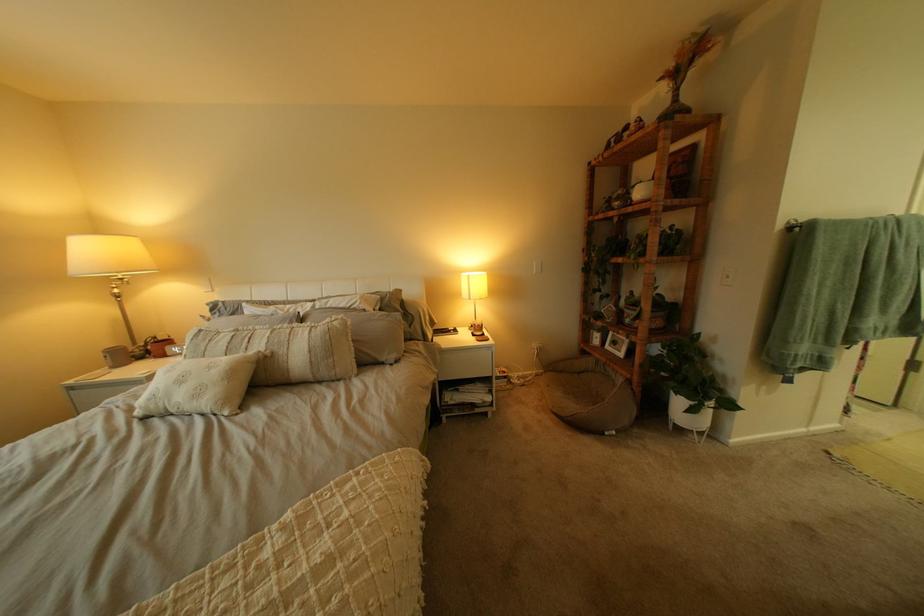
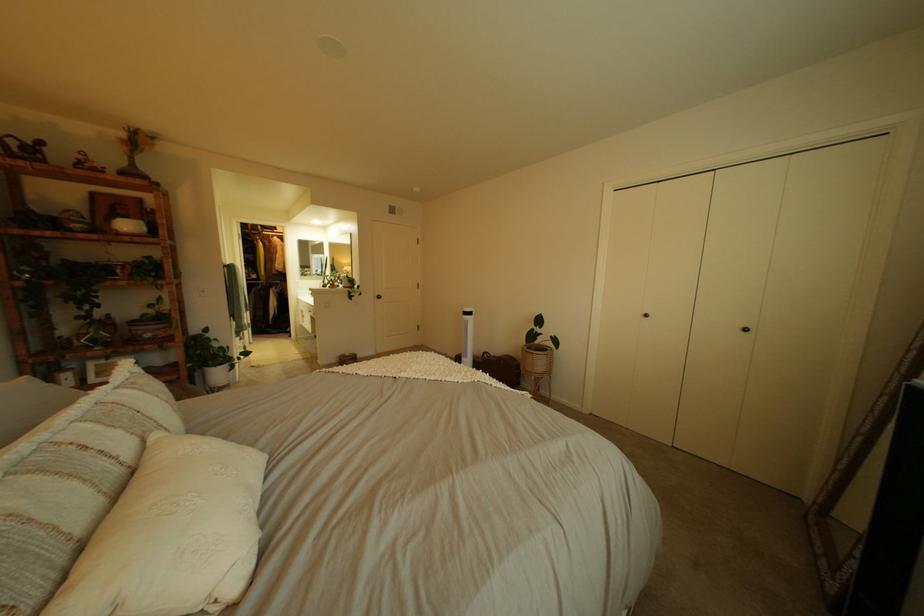
Find the pixel in the second image that matches point (687, 66) in the first image.

(139, 137)